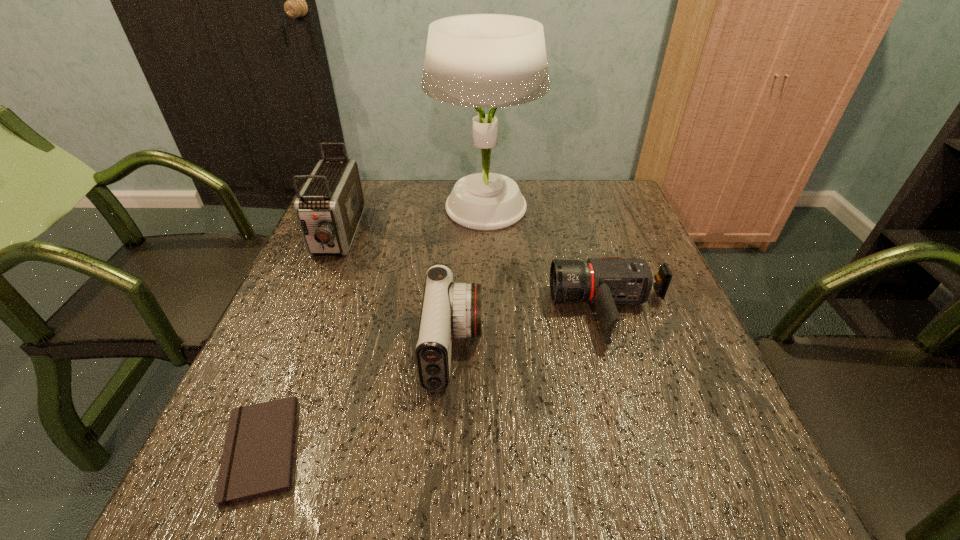
Identify the location of lamp. The height and width of the screenshot is (540, 960). (476, 60).

I want to click on the farthest camcorder, so click(329, 207).

I want to click on the second tallest object, so click(x=329, y=207).

Locate an element on the screen. the second camcorder from right to left is located at coordinates (449, 309).

Where is `the third tallest object`? the third tallest object is located at coordinates (449, 309).

The image size is (960, 540). In order to click on the shortest camcorder in this screenshot , I will do `click(605, 282)`.

Locate an element on the screen. This screenshot has width=960, height=540. the fourth tallest object is located at coordinates (605, 282).

Identify the location of the nearest object. Image resolution: width=960 pixels, height=540 pixels. (257, 461).

Locate an element on the screen. The image size is (960, 540). checkbook is located at coordinates (257, 461).

The height and width of the screenshot is (540, 960). What are the coordinates of `free point located 0.240m on the front-facing side of the tallest object` in the screenshot? It's located at (350, 207).